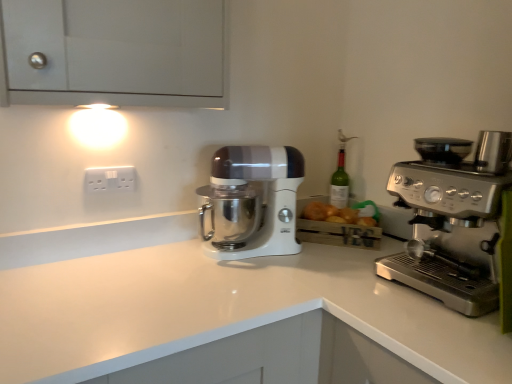
Question: In the image, is satin silver espresso machine at right on the left side or the right side of white glossy countertop at center?

Choices:
 (A) left
 (B) right

Answer: (B)

Question: From the image's perspective, is satin silver espresso machine at right located above or below white glossy countertop at center?

Choices:
 (A) above
 (B) below

Answer: (A)

Question: Estimate the real-world distances between objects in this image. Which object is farther from the white glossy countertop at center?

Choices:
 (A) white plastic electrical outlet at upper left
 (B) satin silver espresso machine at right
 (C) white glossy stand mixer at center
 (D) white matte cabinet at upper left

Answer: (D)

Question: Which object is the closest to the white glossy stand mixer at center?

Choices:
 (A) satin silver espresso machine at right
 (B) white glossy countertop at center
 (C) white matte cabinet at upper left
 (D) white plastic electrical outlet at upper left

Answer: (B)